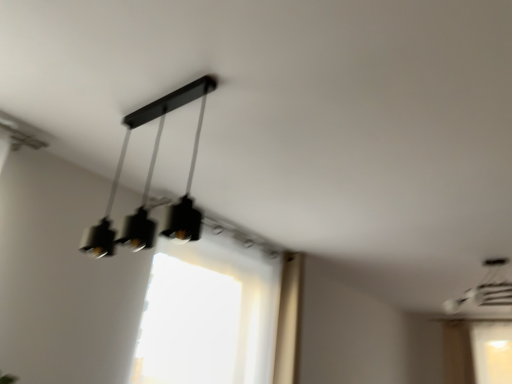
Question: Is matte black pendant light at upper center, which is the 2th lamp in back-to-front order, further to camera compared to transparent fabric window at center?

Choices:
 (A) no
 (B) yes

Answer: (A)

Question: Can we say matte black pendant light at upper center, the 2th lamp in the bottom-to-top sequence, lies outside transparent fabric window at center?

Choices:
 (A) yes
 (B) no

Answer: (A)

Question: Is matte black pendant light at upper center, acting as the 1th lamp starting from the front, touching transparent fabric window at center?

Choices:
 (A) yes
 (B) no

Answer: (B)

Question: Is matte black pendant light at upper center, which is counted as the first lamp, starting from the top, far from transparent fabric window at center?

Choices:
 (A) yes
 (B) no

Answer: (B)

Question: Is transparent fabric window at center inside matte black pendant light at upper center, acting as the 1th lamp starting from the front?

Choices:
 (A) yes
 (B) no

Answer: (B)

Question: From the image's perspective, is transparent fabric window at center located above or below matte black chandelier at upper right, which is the second lamp from left to right?

Choices:
 (A) below
 (B) above

Answer: (A)

Question: Looking at their shapes, would you say transparent fabric window at center is wider or thinner than matte black chandelier at upper right, which ranks as the first lamp in right-to-left order?

Choices:
 (A) wide
 (B) thin

Answer: (B)

Question: Do you think transparent fabric window at center is within matte black chandelier at upper right, which is counted as the first lamp, starting from the bottom, or outside of it?

Choices:
 (A) outside
 (B) inside

Answer: (A)

Question: Considering the positions of transparent fabric window at center and matte black chandelier at upper right, which is counted as the first lamp, starting from the bottom, in the image, is transparent fabric window at center taller or shorter than matte black chandelier at upper right, which is counted as the first lamp, starting from the bottom,?

Choices:
 (A) short
 (B) tall

Answer: (B)

Question: Do you think matte black chandelier at upper right, which is counted as the first lamp, starting from the bottom, is within transparent fabric window at center, or outside of it?

Choices:
 (A) inside
 (B) outside

Answer: (B)

Question: Does point (487, 281) appear closer or farther from the camera than point (178, 372)?

Choices:
 (A) closer
 (B) farther

Answer: (B)

Question: In the image, is matte black chandelier at upper right, which is counted as the first lamp, starting from the bottom, on the left side or the right side of transparent fabric window at center?

Choices:
 (A) left
 (B) right

Answer: (B)

Question: Is matte black chandelier at upper right, which is the second lamp from left to right, in front of or behind transparent fabric window at center in the image?

Choices:
 (A) front
 (B) behind

Answer: (B)

Question: From their relative heights in the image, would you say matte black chandelier at upper right, the first lamp when ordered from back to front, is taller or shorter than matte black pendant light at upper center, placed as the 2th lamp when sorted from right to left?

Choices:
 (A) short
 (B) tall

Answer: (A)

Question: In terms of size, does matte black chandelier at upper right, marked as the second lamp in a top-to-bottom arrangement, appear bigger or smaller than matte black pendant light at upper center, placed as the 2th lamp when sorted from right to left?

Choices:
 (A) big
 (B) small

Answer: (A)